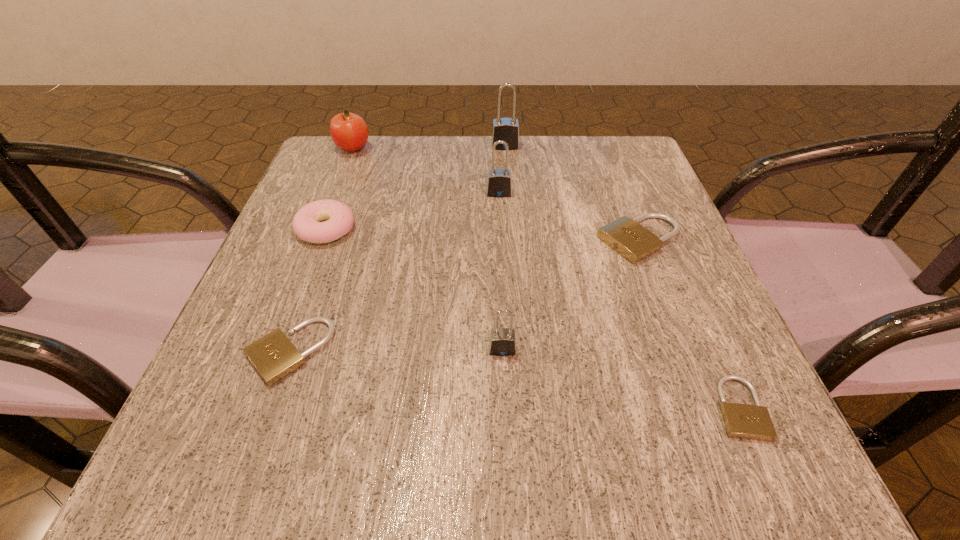
Where is `vacant space located on the front of the fourth tallest padlock`? This screenshot has width=960, height=540. vacant space located on the front of the fourth tallest padlock is located at coordinates (704, 409).

At what (x,y) coordinates should I click in order to perform the action: click on vacant area situated on the right of the leftmost padlock. Please return your answer as a coordinate pair (x, y). This screenshot has width=960, height=540. Looking at the image, I should click on (515, 352).

This screenshot has width=960, height=540. Find the location of `blank space located 0.070m on the back of the smallest beige padlock`. blank space located 0.070m on the back of the smallest beige padlock is located at coordinates (708, 337).

You are a GUI agent. You are given a task and a screenshot of the screen. Output one action in this format:
    pyautogui.click(x=<x>, y=<y>)
    Task: Click on the apple at the far edge
    This screenshot has height=540, width=960.
    Given the screenshot: What is the action you would take?
    pyautogui.click(x=349, y=131)

The width and height of the screenshot is (960, 540). Find the location of `object at the near edge`. object at the near edge is located at coordinates (744, 421).

At what (x,y) coordinates should I click in order to perform the action: click on apple that is at the left edge. Please return your answer as a coordinate pair (x, y). Image resolution: width=960 pixels, height=540 pixels. Looking at the image, I should click on (349, 131).

Where is `doughnut at the left edge`? This screenshot has width=960, height=540. doughnut at the left edge is located at coordinates 307,225.

Locate an element on the screen. The image size is (960, 540). padlock located at the left edge is located at coordinates (274, 356).

Identify the location of object at the far left corner. (349, 131).

Locate an element on the screen. The height and width of the screenshot is (540, 960). object that is at the near right corner is located at coordinates (744, 421).